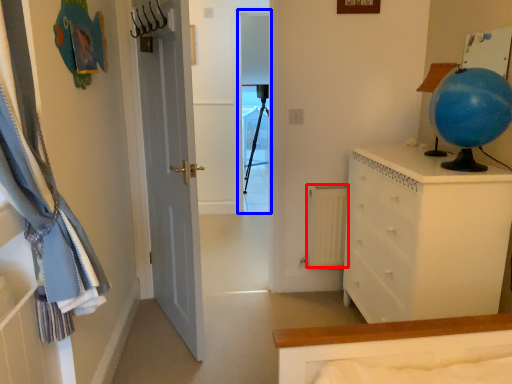
Question: Which object is further to the camera taking this photo, radiator (highlighted by a red box) or screen door (highlighted by a blue box)?

Choices:
 (A) radiator
 (B) screen door

Answer: (B)